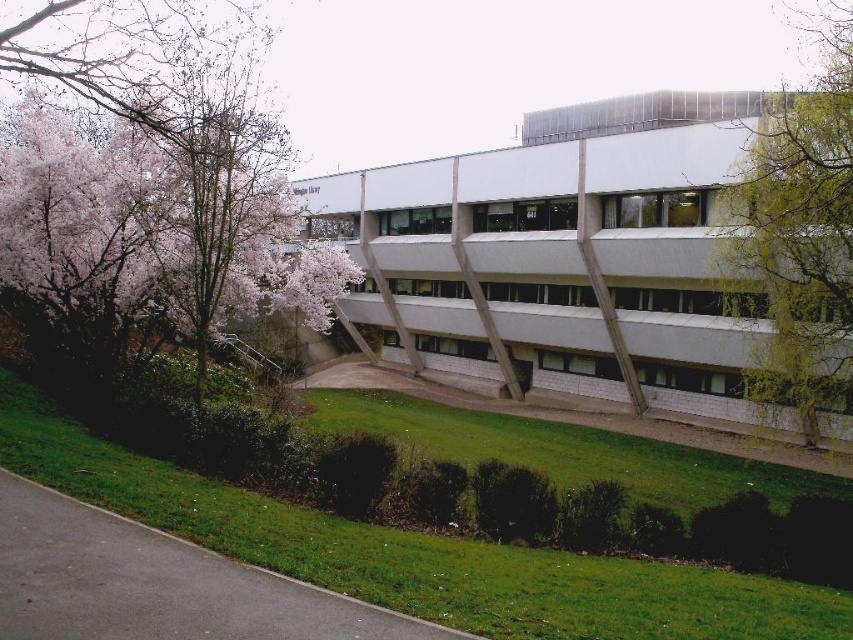
Question: Does pink blossoming tree at left appear under green leafy tree at right?

Choices:
 (A) no
 (B) yes

Answer: (A)

Question: Can you confirm if pink blossoming tree at left is positioned above green leafy tree at right?

Choices:
 (A) no
 (B) yes

Answer: (B)

Question: Among these points, which one is nearest to the camera?

Choices:
 (A) (38, 154)
 (B) (741, 168)

Answer: (A)

Question: In this image, where is pink blossoming tree at left located relative to green leafy tree at right?

Choices:
 (A) below
 (B) above

Answer: (B)